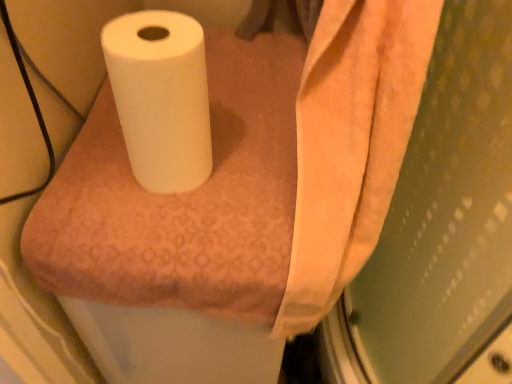
This screenshot has width=512, height=384. Find the location of `vacant space situated on the left part of white matte toilet paper at center`. vacant space situated on the left part of white matte toilet paper at center is located at coordinates (88, 164).